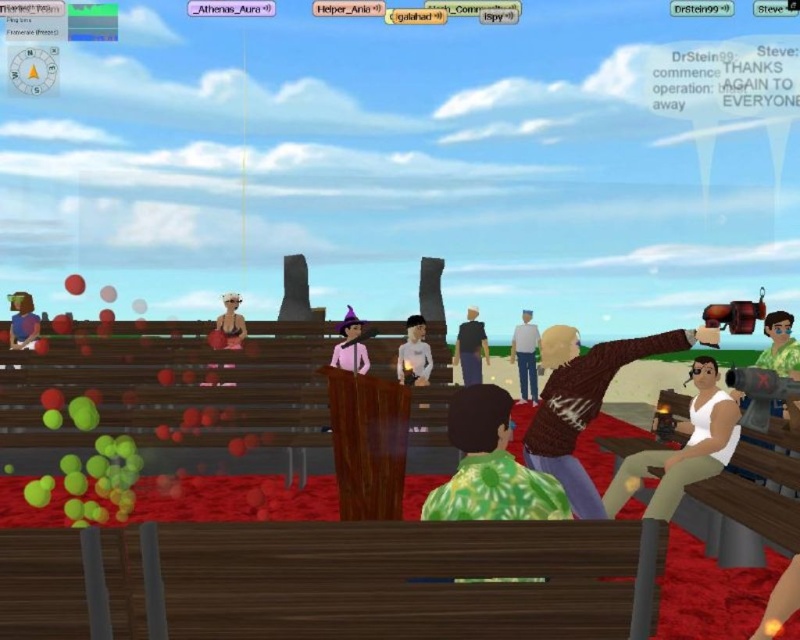
In the scene shown: Who is higher up, knitted brown sweater at center or blue denim jeans at center?

knitted brown sweater at center is higher up.

Locate an element on the screen. The height and width of the screenshot is (640, 800). knitted brown sweater at center is located at coordinates (584, 410).

Find the location of `knitted brown sweater at center`. knitted brown sweater at center is located at coordinates (584, 410).

Is green tie-dye shirt at right below light gray sweater at center?

Actually, green tie-dye shirt at right is above light gray sweater at center.

Is point (772, 365) positioned behind point (532, 344)?

No, it is in front of (532, 344).

Locate an element on the screen. The width and height of the screenshot is (800, 640). green tie-dye shirt at right is located at coordinates (780, 346).

Which of these two, wooden bench at lower right or green tie-dye shirt at center, stands taller?

With more height is wooden bench at lower right.

Does point (720, 476) come behind point (466, 476)?

Yes, it is.

Which is behind, point (760, 532) or point (468, 412)?

The point (760, 532) is behind.

The image size is (800, 640). In order to click on wooden bench at lower right in this screenshot , I will do `click(748, 502)`.